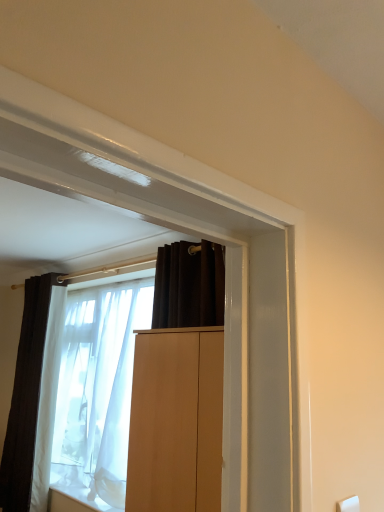
Question: Considering the relative sizes of white matte window sill at lower left and light brown wood cabinet at center in the image provided, is white matte window sill at lower left bigger than light brown wood cabinet at center?

Choices:
 (A) yes
 (B) no

Answer: (B)

Question: From a real-world perspective, is white matte window sill at lower left located higher than light brown wood cabinet at center?

Choices:
 (A) yes
 (B) no

Answer: (B)

Question: Does white matte window sill at lower left appear on the left side of light brown wood cabinet at center?

Choices:
 (A) yes
 (B) no

Answer: (A)

Question: Is white matte window sill at lower left looking in the opposite direction of light brown wood cabinet at center?

Choices:
 (A) yes
 (B) no

Answer: (B)

Question: Could you tell me if white matte window sill at lower left is facing light brown wood cabinet at center?

Choices:
 (A) no
 (B) yes

Answer: (A)

Question: Considering the relative sizes of white matte window sill at lower left and light brown wood cabinet at center in the image provided, is white matte window sill at lower left smaller than light brown wood cabinet at center?

Choices:
 (A) yes
 (B) no

Answer: (A)

Question: Is white sheer fabric at center far away from white matte window sill at lower left?

Choices:
 (A) yes
 (B) no

Answer: (B)

Question: Is white sheer fabric at center closer to camera compared to white matte window sill at lower left?

Choices:
 (A) no
 (B) yes

Answer: (B)

Question: From the image's perspective, is white sheer fabric at center on white matte window sill at lower left?

Choices:
 (A) no
 (B) yes

Answer: (B)

Question: From the image's perspective, would you say white sheer fabric at center is shown under white matte window sill at lower left?

Choices:
 (A) yes
 (B) no

Answer: (B)

Question: Is white sheer fabric at center outside white matte window sill at lower left?

Choices:
 (A) yes
 (B) no

Answer: (A)

Question: Is the position of white sheer fabric at center more distant than that of white matte window sill at lower left?

Choices:
 (A) yes
 (B) no

Answer: (B)

Question: Can you confirm if light brown wood cabinet at center is shorter than white sheer fabric at center?

Choices:
 (A) yes
 (B) no

Answer: (A)